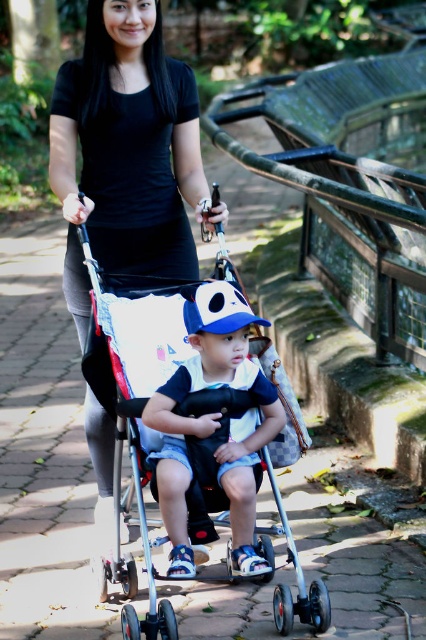
You are a photographer setting up a shot of the silver metallic stroller at center and the matte blue cap at center. You need to frame both objects in your camera viewfinder. Since you want to ensure that both fit horizontally, which object should you adjust your focus on to accommodate their widths?

The silver metallic stroller at center is wider than the matte blue cap at center, so you should adjust your focus to include the wider silver metallic stroller at center to ensure both fit horizontally.

You are a photographer standing in the park and want to take a photo of the silver metallic stroller at center and the matte blue cap at center. Which object is positioned to the right side in the image?

The matte blue cap at center is positioned to the right side of the silver metallic stroller at center.